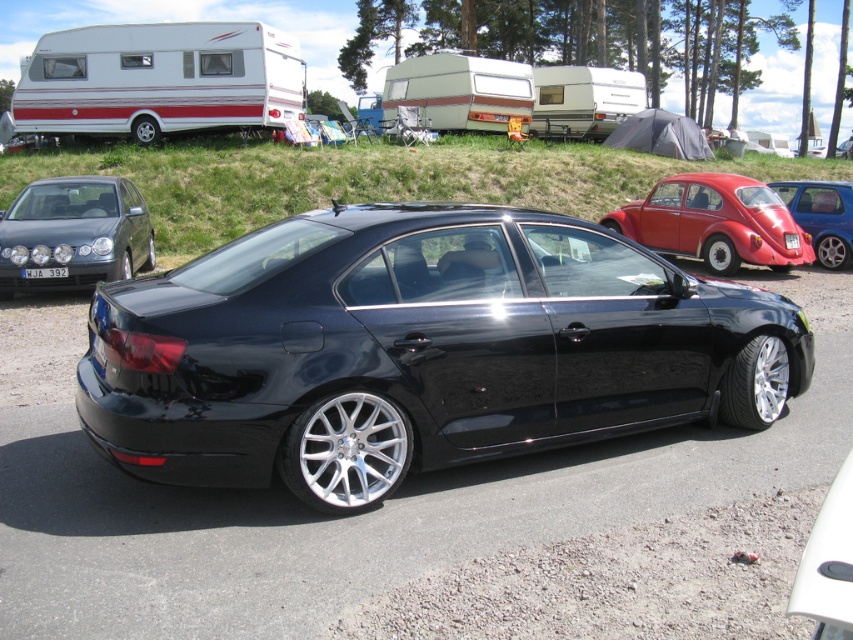
You are a driver trying to park your car in the campsite. You see the glossy black sedan at center and the metallic red car at right. Which car is positioned lower in the image?

The glossy black sedan at center is located below the metallic red car at right, so it is positioned lower in the image.

You are a security guard at the campsite and need to verify the license plates of two cars parked nearby. You observe the white plastic license plate at center and the black plastic license plate at center. Which license plate is located to the left of the other?

The white plastic license plate at center is positioned on the left side of black plastic license plate at center.

From the picture: You are standing in a campsite and see the glossy black sedan at center and the metallic red car at right. Which car is nearer to you?

The glossy black sedan at center is closer to the viewer than the metallic red car at right.